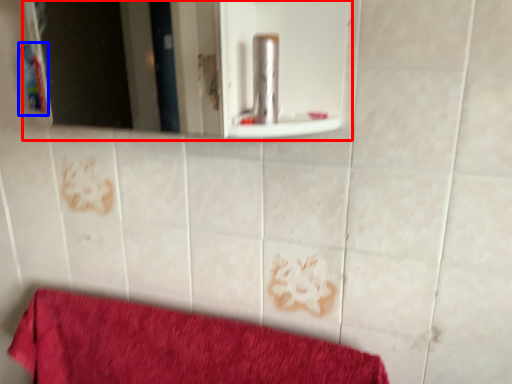
Question: Which point is further to the camera, mirror (highlighted by a red box) or toiletry (highlighted by a blue box)?

Choices:
 (A) mirror
 (B) toiletry

Answer: (B)